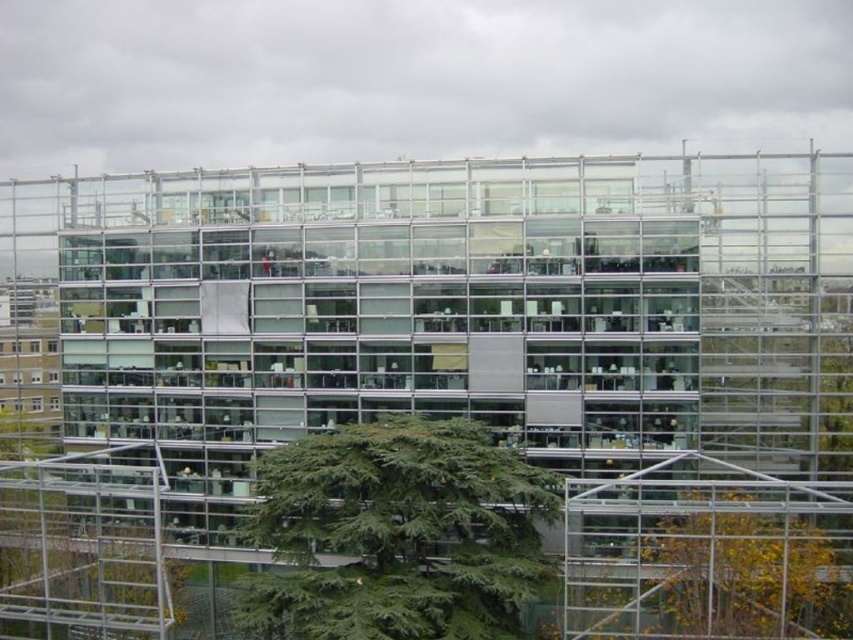
Question: Is green needle-like leaves at center to the left of green leafy tree at lower right from the viewer's perspective?

Choices:
 (A) yes
 (B) no

Answer: (A)

Question: Which point is farther to the camera?

Choices:
 (A) (502, 456)
 (B) (584, 513)

Answer: (A)

Question: Can you confirm if green needle-like leaves at center is positioned to the left of green leafy tree at lower right?

Choices:
 (A) yes
 (B) no

Answer: (A)

Question: Which of the following is the closest to the observer?

Choices:
 (A) green needle-like leaves at center
 (B) green leafy tree at lower right

Answer: (A)

Question: Which point is closer to the camera?

Choices:
 (A) (515, 589)
 (B) (666, 602)

Answer: (A)

Question: Does green needle-like leaves at center have a greater width compared to green leafy tree at lower right?

Choices:
 (A) yes
 (B) no

Answer: (B)